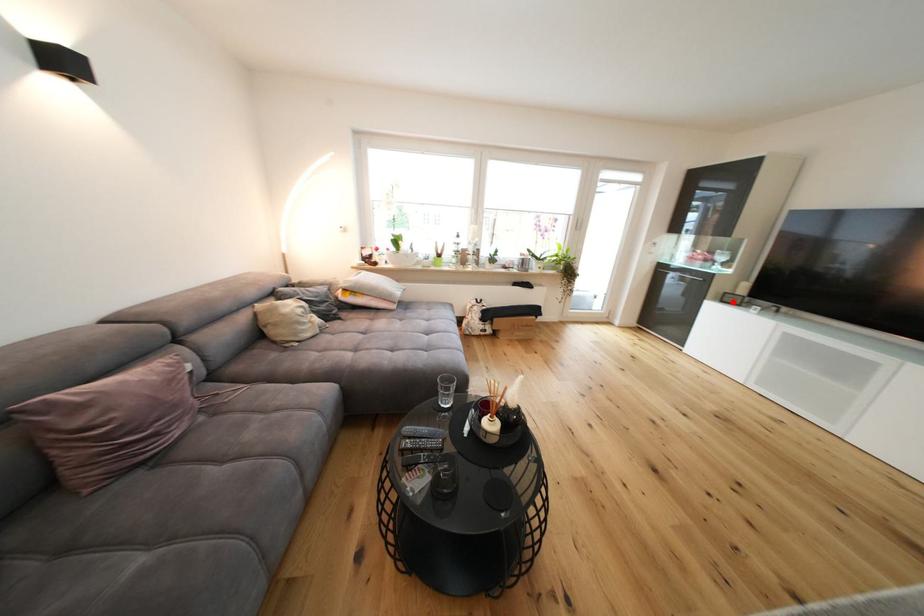
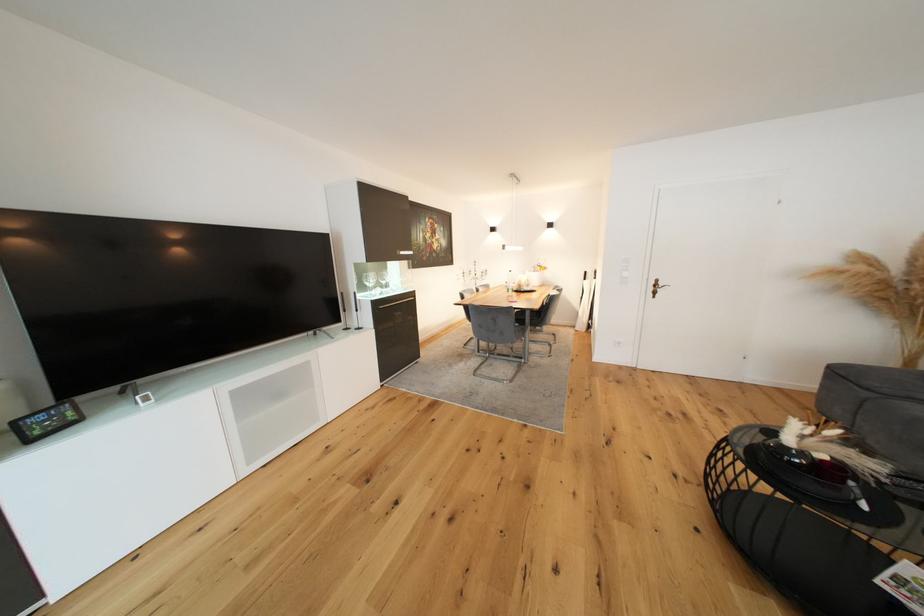
Where in the second image is the point corresponding to the highlighted location from the first image?

(44, 434)